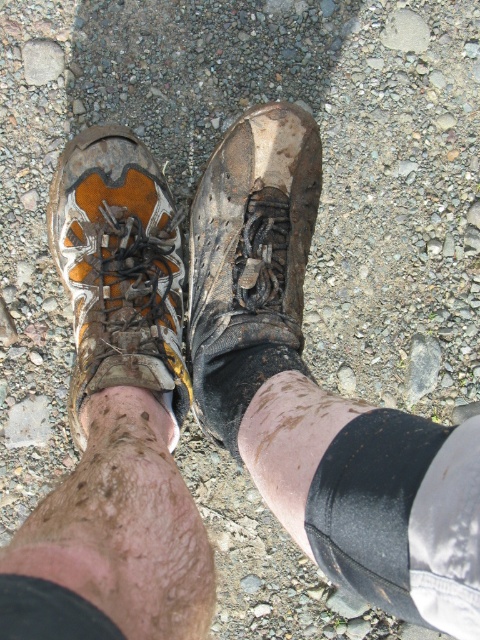
Question: Does dirty leather boot at center have a lesser width compared to orange suede boot at left?

Choices:
 (A) no
 (B) yes

Answer: (B)

Question: Among these points, which one is farthest from the camera?

Choices:
 (A) (372, 452)
 (B) (213, 404)
 (C) (71, 600)
 (D) (153, 326)

Answer: (D)

Question: Is black matte/soft fabric at lower center above black fabric at lower center?

Choices:
 (A) no
 (B) yes

Answer: (B)

Question: Which point is closer to the camera?

Choices:
 (A) black matte/soft fabric at lower center
 (B) orange suede boot at left
 (C) dirty leather boot at center
 (D) black fabric at lower center

Answer: (D)

Question: Can you confirm if black matte/soft fabric at lower center is positioned to the right of black fabric at lower center?

Choices:
 (A) yes
 (B) no

Answer: (A)

Question: Which of the following is the closest to the observer?

Choices:
 (A) dirty leather boot at center
 (B) black matte/soft fabric at lower center

Answer: (B)